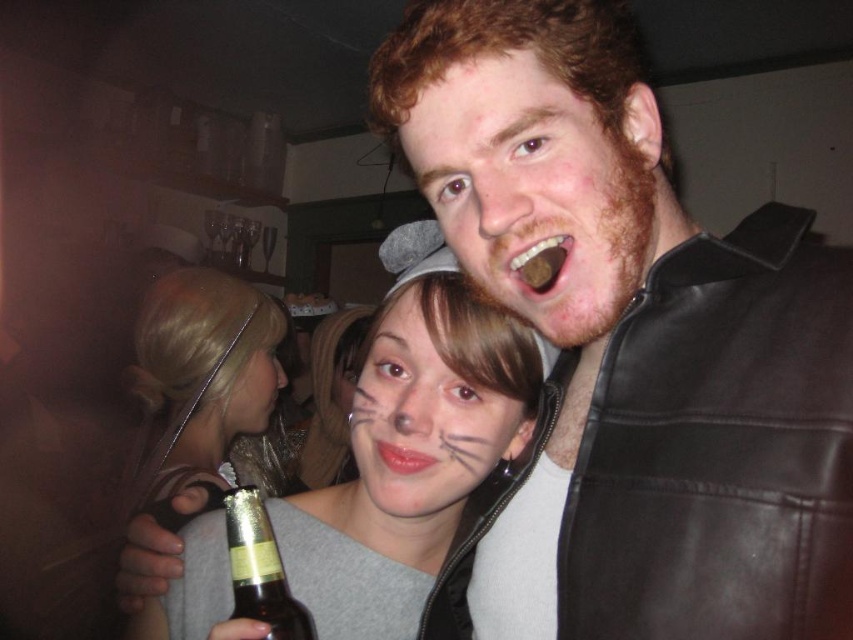
Can you confirm if black leather jacket at center is smaller than matte gray sweater at center?

Correct, black leather jacket at center occupies less space than matte gray sweater at center.

Measure the distance from black leather jacket at center to matte gray sweater at center.

black leather jacket at center is 28.78 inches from matte gray sweater at center.

Describe the element at coordinates (630, 346) in the screenshot. The width and height of the screenshot is (853, 640). I see `black leather jacket at center` at that location.

Identify the location of black leather jacket at center. (630, 346).

Is black leather jacket at center to the right of smooth matte gray cat ears at center from the viewer's perspective?

Indeed, black leather jacket at center is positioned on the right side of smooth matte gray cat ears at center.

Is point (735, 269) positioned in front of point (349, 404)?

That is True.

Identify the location of black leather jacket at center. The height and width of the screenshot is (640, 853). (630, 346).

Can you confirm if brown glass bottle at lower left is positioned below glossy matte lips at center?

Yes, brown glass bottle at lower left is below glossy matte lips at center.

Which is behind, point (256, 556) or point (408, 451)?

Positioned behind is point (408, 451).

At what (x,y) coordinates should I click in order to perform the action: click on brown glass bottle at lower left. Please return your answer as a coordinate pair (x, y). This screenshot has height=640, width=853. Looking at the image, I should click on pos(260,568).